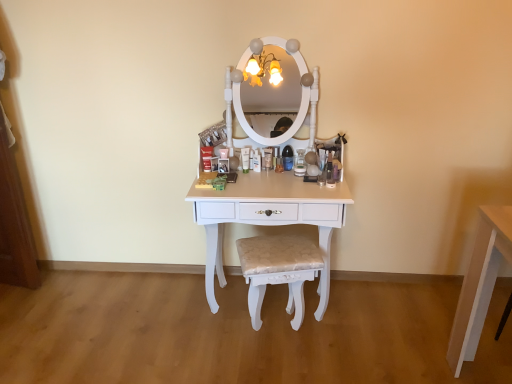
Question: From the image's perspective, is white glossy table at center located above or below matte white tube at center?

Choices:
 (A) above
 (B) below

Answer: (B)

Question: Is white glossy table at center inside or outside of matte white tube at center?

Choices:
 (A) inside
 (B) outside

Answer: (B)

Question: Which of these objects is positioned closest to the beige fabric cushioned stool at center?

Choices:
 (A) matte white tube at center
 (B) white glossy table at center

Answer: (B)

Question: Considering the real-world distances, which object is closest to the beige fabric cushioned stool at center?

Choices:
 (A) white glossy table at center
 (B) matte white tube at center

Answer: (A)